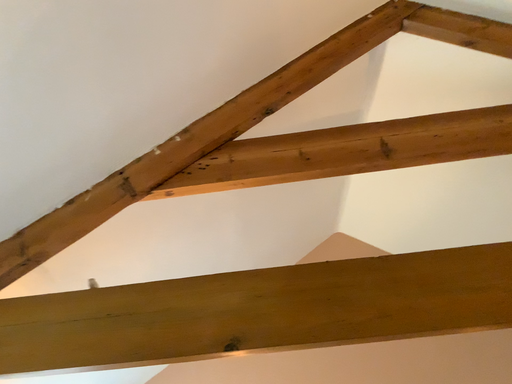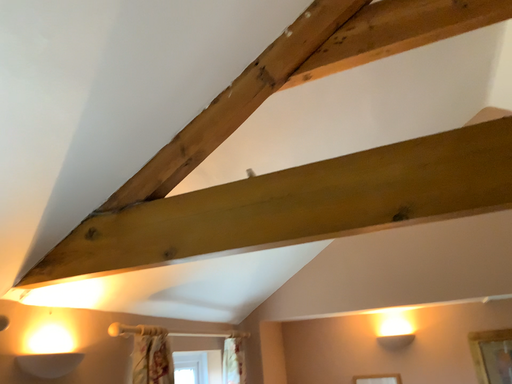
Question: How did the camera likely rotate when shooting the video?

Choices:
 (A) rotated right
 (B) rotated left

Answer: (B)